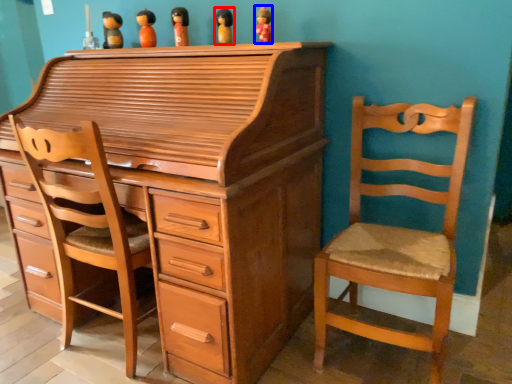
Question: Among these objects, which one is farthest to the camera, toy (highlighted by a red box) or toy (highlighted by a blue box)?

Choices:
 (A) toy
 (B) toy

Answer: (A)